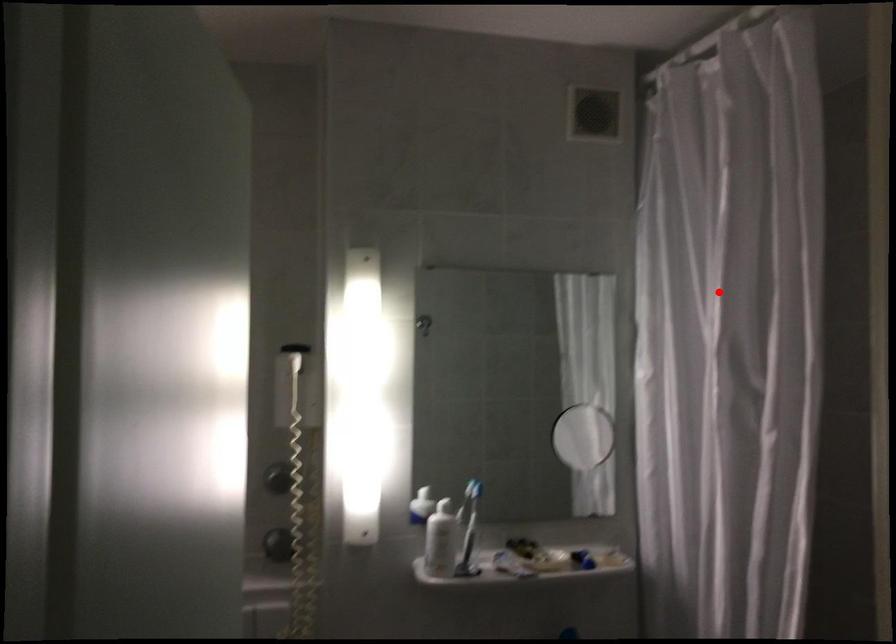
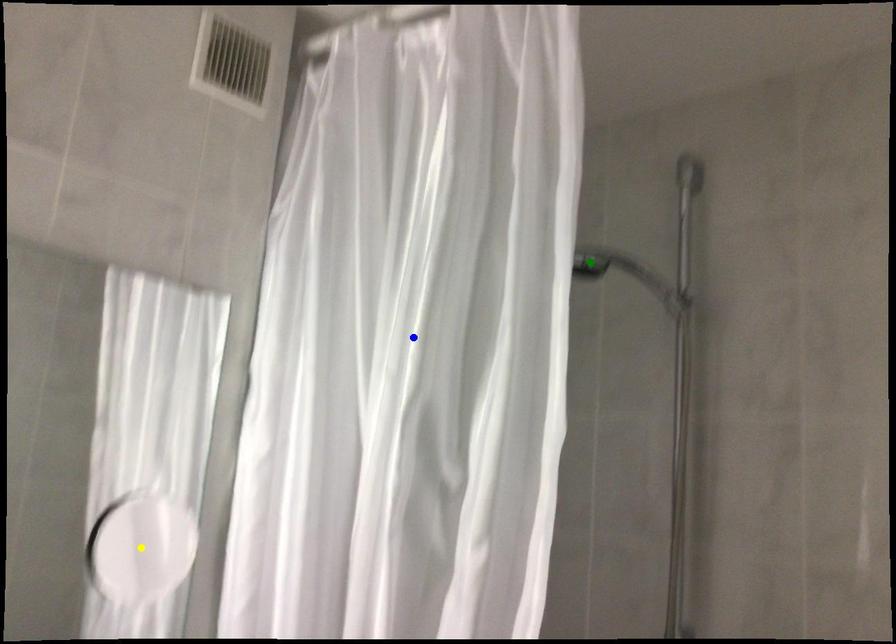
Question: I am providing you with two images of the same scene from different viewpoints. A red point is marked on the first image. You are given multiple points on the second image. In image 2, which mark is for the same physical point as the one in image 1?

Choices:
 (A) blue point
 (B) green point
 (C) yellow point

Answer: (A)